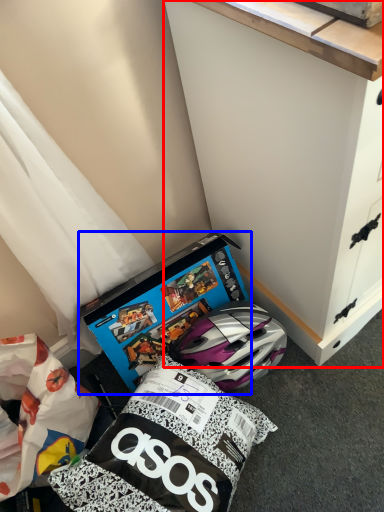
Question: Which point is closer to the camera, cabinetry (highlighted by a red box) or box (highlighted by a blue box)?

Choices:
 (A) cabinetry
 (B) box

Answer: (A)